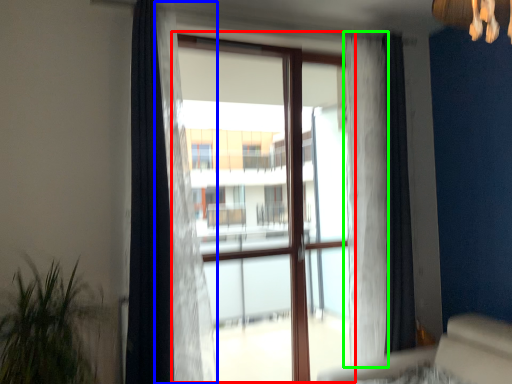
Question: Based on their relative distances, which object is farther from bay window (highlighted by a red box)? Choose from curtain (highlighted by a blue box) and curtain (highlighted by a green box).

Choices:
 (A) curtain
 (B) curtain

Answer: (A)